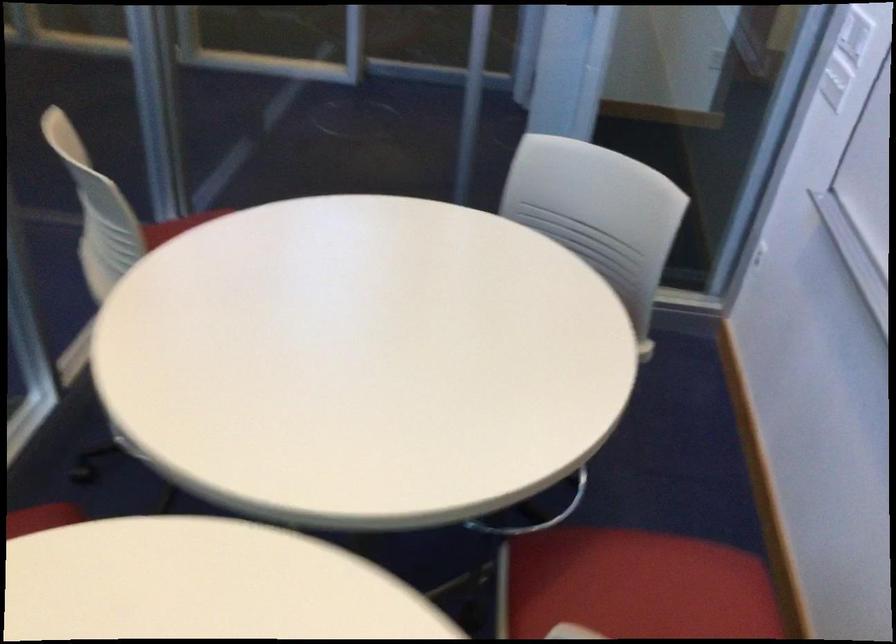
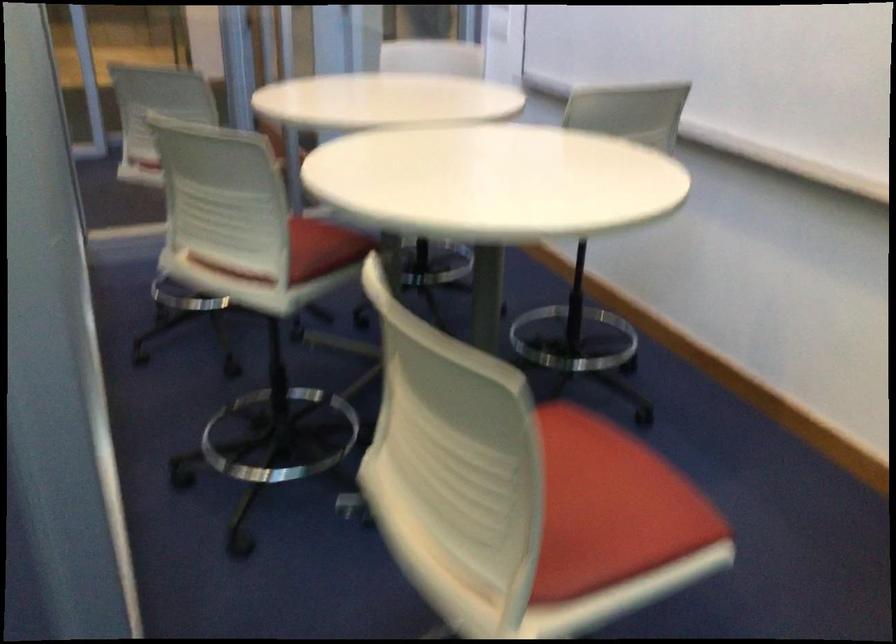
The point at (x=100, y=261) is marked in the first image. Where is the corresponding point in the second image?

(149, 166)